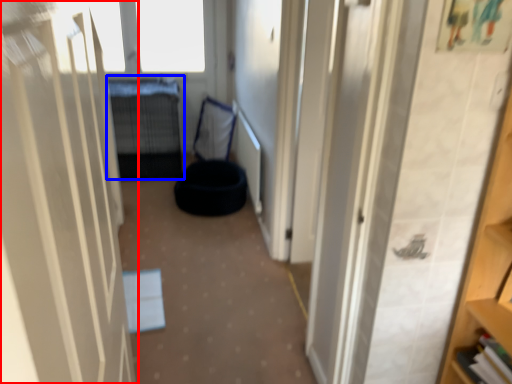
Question: Among these objects, which one is farthest to the camera, door (highlighted by a red box) or bed (highlighted by a blue box)?

Choices:
 (A) door
 (B) bed

Answer: (B)